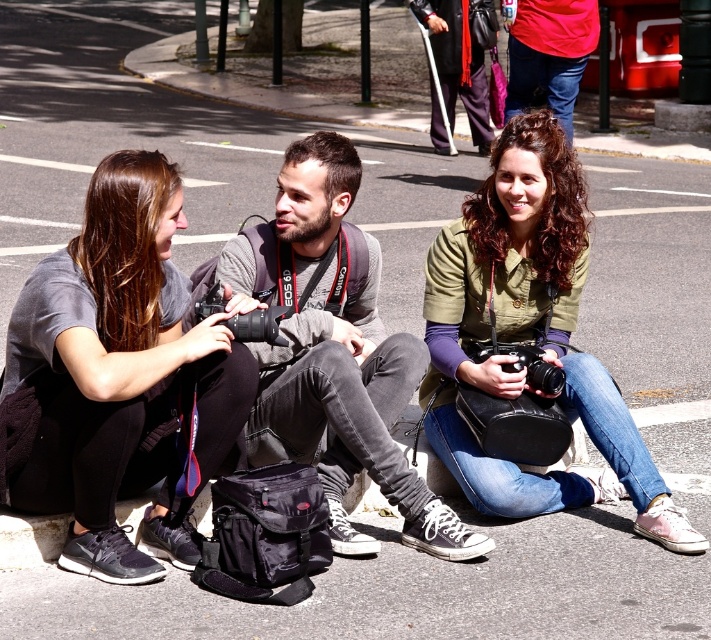
Question: Which is nearer to the matte black camera at left?

Choices:
 (A) green matte shirt at center
 (B) matte gray shirt at center

Answer: (B)

Question: Which object is the closest to the green matte shirt at center?

Choices:
 (A) matte black camera at left
 (B) matte gray shirt at center

Answer: (B)

Question: From the image, what is the correct spatial relationship of green matte shirt at center in relation to matte gray shirt at center?

Choices:
 (A) right
 (B) left

Answer: (A)

Question: Does matte black camera at left have a greater width compared to matte gray shirt at center?

Choices:
 (A) yes
 (B) no

Answer: (B)

Question: Can you confirm if green matte shirt at center is bigger than matte gray shirt at center?

Choices:
 (A) no
 (B) yes

Answer: (B)

Question: Which object is closer to the camera taking this photo?

Choices:
 (A) matte black camera at left
 (B) green matte shirt at center

Answer: (A)